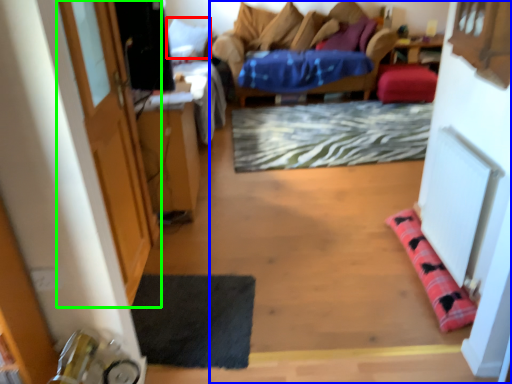
Question: Estimate the real-world distances between objects in this image. Which object is closer to pillow (highlighted by a red box), studio couch (highlighted by a blue box) or door (highlighted by a green box)?

Choices:
 (A) studio couch
 (B) door

Answer: (B)